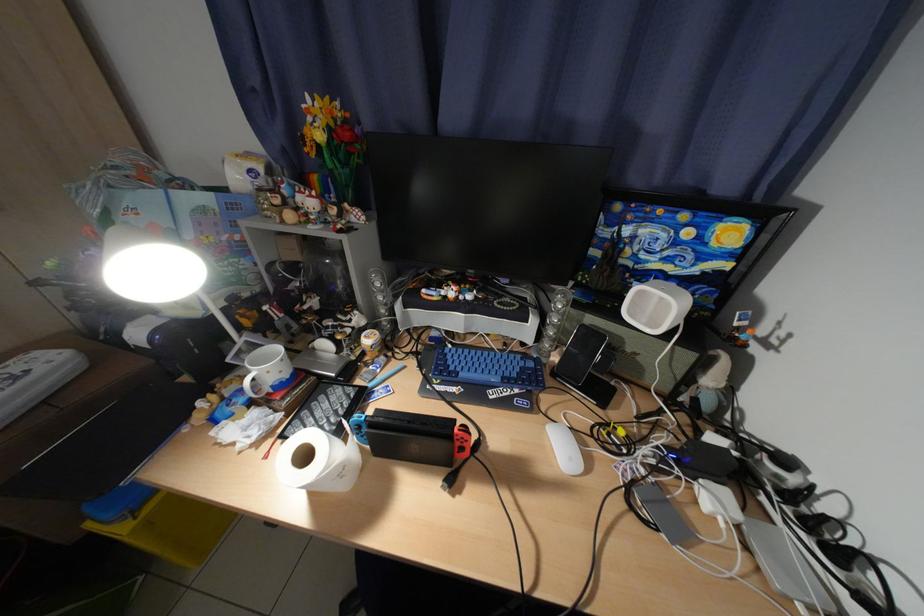
The width and height of the screenshot is (924, 616). I want to click on blue and white tube, so click(x=678, y=461).